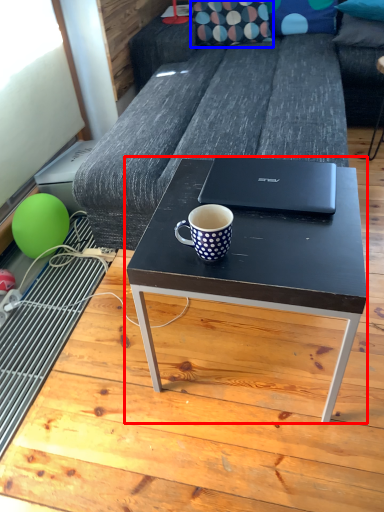
Question: Which object is further to the camera taking this photo, coffee table (highlighted by a red box) or pillow (highlighted by a blue box)?

Choices:
 (A) coffee table
 (B) pillow

Answer: (B)